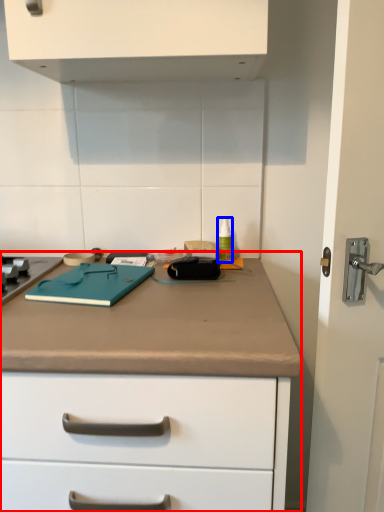
Question: Which of the following is the farthest to the observer, counter (highlighted by a red box) or bottle (highlighted by a blue box)?

Choices:
 (A) counter
 (B) bottle

Answer: (B)